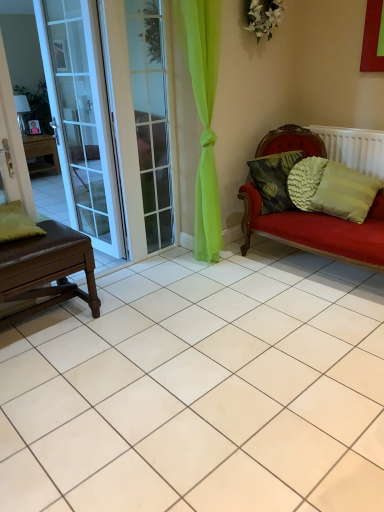
Question: Can you confirm if brown leather table at left is positioned to the left of textured green pillow at right, which is counted as the 2th pillow, starting from the right?

Choices:
 (A) no
 (B) yes

Answer: (B)

Question: Is textured green pillow at right, which is counted as the 2th pillow, starting from the right, inside brown leather table at left?

Choices:
 (A) no
 (B) yes

Answer: (A)

Question: Is brown leather table at left with textured green pillow at right, which is counted as the 2th pillow, starting from the right?

Choices:
 (A) yes
 (B) no

Answer: (B)

Question: Does brown leather table at left have a larger size compared to textured green pillow at right, the third pillow when ordered from left to right?

Choices:
 (A) no
 (B) yes

Answer: (B)

Question: From a real-world perspective, is brown leather table at left on top of textured green pillow at right, which is counted as the 2th pillow, starting from the right?

Choices:
 (A) no
 (B) yes

Answer: (A)

Question: From the image's perspective, relative to white plastic radiator at right, is green matte pillow at left, the fourth pillow in the right-to-left sequence, above or below?

Choices:
 (A) below
 (B) above

Answer: (A)

Question: Is green matte pillow at left, the fourth pillow in the right-to-left sequence, inside the boundaries of white plastic radiator at right, or outside?

Choices:
 (A) inside
 (B) outside

Answer: (B)

Question: In terms of size, does green matte pillow at left, the fourth pillow in the right-to-left sequence, appear bigger or smaller than white plastic radiator at right?

Choices:
 (A) big
 (B) small

Answer: (B)

Question: In the image, is green matte pillow at left, placed as the first pillow when sorted from left to right, on the left side or the right side of white plastic radiator at right?

Choices:
 (A) left
 (B) right

Answer: (A)

Question: Relative to green textured pillow at right, positioned as the 4th pillow in left-to-right order, is green matte pillow at left, the fourth pillow in the right-to-left sequence, in front or behind?

Choices:
 (A) front
 (B) behind

Answer: (A)

Question: Is green matte pillow at left, placed as the first pillow when sorted from left to right, spatially inside green textured pillow at right, positioned as the 4th pillow in left-to-right order, or outside of it?

Choices:
 (A) inside
 (B) outside

Answer: (B)

Question: Is green matte pillow at left, placed as the first pillow when sorted from left to right, bigger or smaller than green textured pillow at right, which ranks as the first pillow in right-to-left order?

Choices:
 (A) big
 (B) small

Answer: (B)

Question: From a real-world perspective, is green matte pillow at left, placed as the first pillow when sorted from left to right, positioned above or below green textured pillow at right, positioned as the 4th pillow in left-to-right order?

Choices:
 (A) below
 (B) above

Answer: (B)

Question: Choose the correct answer: Is white plastic radiator at right inside green matte pillow at left, the fourth pillow in the right-to-left sequence, or outside it?

Choices:
 (A) inside
 (B) outside

Answer: (B)

Question: In terms of size, does white plastic radiator at right appear bigger or smaller than green matte pillow at left, placed as the first pillow when sorted from left to right?

Choices:
 (A) big
 (B) small

Answer: (A)